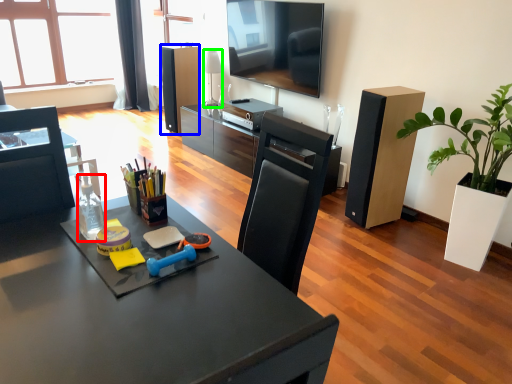
Question: Considering the real-world distances, which object is closest to bottle (highlighted by a red box)? speaker (highlighted by a blue box) or lamp (highlighted by a green box).

Choices:
 (A) speaker
 (B) lamp

Answer: (B)